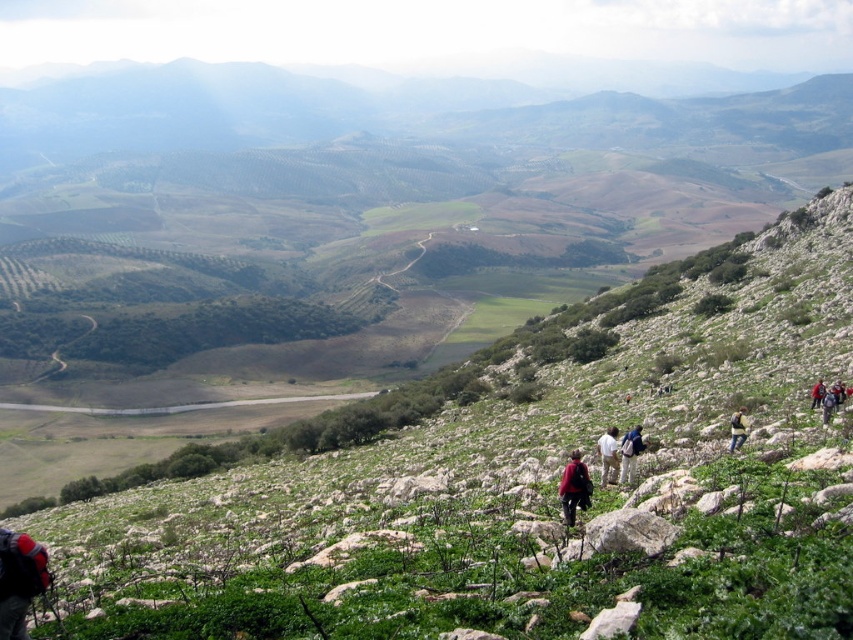
Consider the image. You are a hiker who wants to place a marker between the dark red backpack at center and the red fabric backpack at lower right. Based on their positions, where should the marker be placed?

The marker should be placed above the dark red backpack at center and below the red fabric backpack at lower right since the dark red backpack at center is located below the red fabric backpack at lower right.